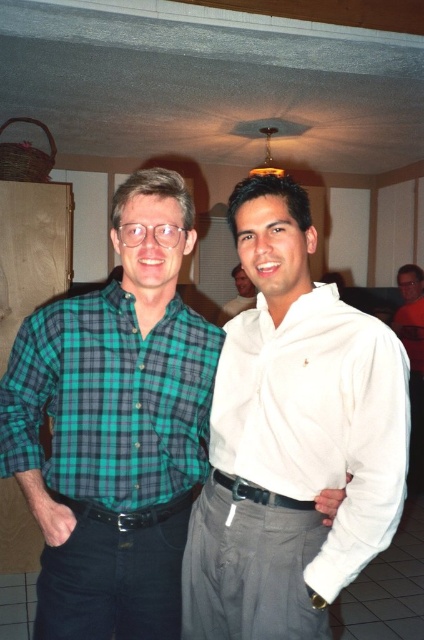
Does orange t-shirt at right have a lesser height compared to white matte shirt at center?

Incorrect, orange t-shirt at right's height does not fall short of white matte shirt at center's.

Based on the photo, is orange t-shirt at right taller than white matte shirt at center?

Yes, orange t-shirt at right is taller than white matte shirt at center.

Locate an element on the screen. Image resolution: width=424 pixels, height=640 pixels. orange t-shirt at right is located at coordinates (412, 360).

Is point (153, 202) positioned in front of point (420, 408)?

Yes, it is in front of point (420, 408).

Can you confirm if green plaid shirt at center is bigger than orange t-shirt at right?

No, green plaid shirt at center is not bigger than orange t-shirt at right.

You are a GUI agent. You are given a task and a screenshot of the screen. Output one action in this format:
    pyautogui.click(x=<x>, y=<y>)
    Task: Click on the green plaid shirt at center
    
    Given the screenshot: What is the action you would take?
    pyautogui.click(x=114, y=428)

Can you confirm if white cotton shirt at center is wider than green plaid shirt at left?

In fact, white cotton shirt at center might be narrower than green plaid shirt at left.

Can you confirm if white cotton shirt at center is bigger than green plaid shirt at left?

Yes.

Is point (393, 381) positioned before point (83, 340)?

Yes, point (393, 381) is closer to viewer.

The image size is (424, 640). I want to click on white cotton shirt at center, so click(318, 420).